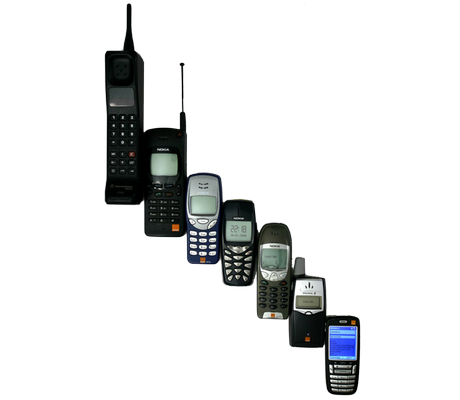
You are a GUI agent. You are given a task and a screenshot of the screen. Output one action in this format:
    pyautogui.click(x=<x>, y=<y>)
    Task: Click on the lcd displays
    This screenshot has height=400, width=460.
    Given the screenshot: What is the action you would take?
    pyautogui.click(x=124, y=95), pyautogui.click(x=164, y=165), pyautogui.click(x=202, y=205), pyautogui.click(x=237, y=230), pyautogui.click(x=273, y=254), pyautogui.click(x=308, y=300), pyautogui.click(x=343, y=347)